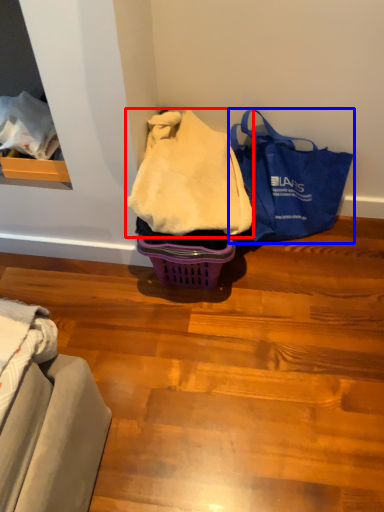
Question: Which object appears closest to the camera in this image, blanket (highlighted by a red box) or handbag (highlighted by a blue box)?

Choices:
 (A) blanket
 (B) handbag

Answer: (A)